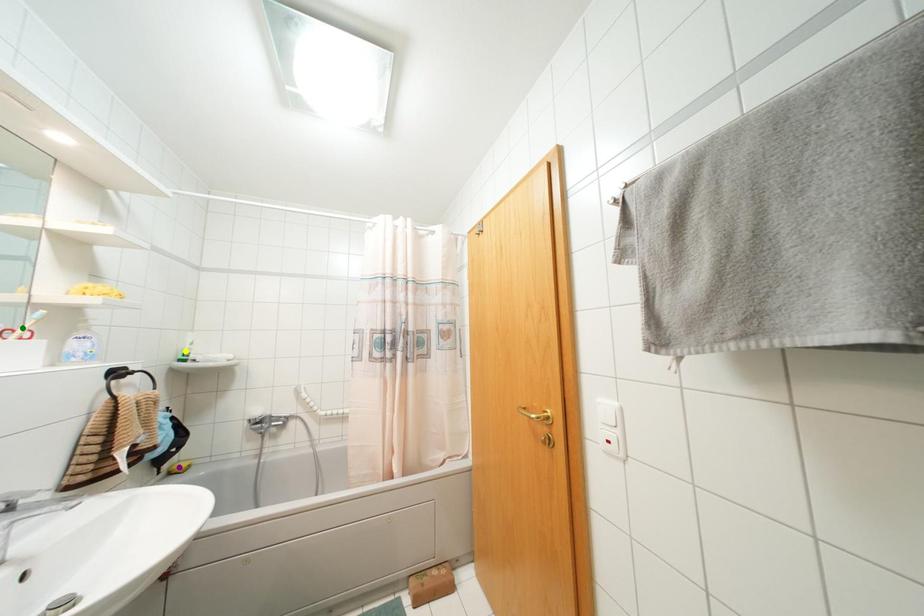
Order these from nearest to farthest:
- yellow point
- green point
- purple point

green point
purple point
yellow point